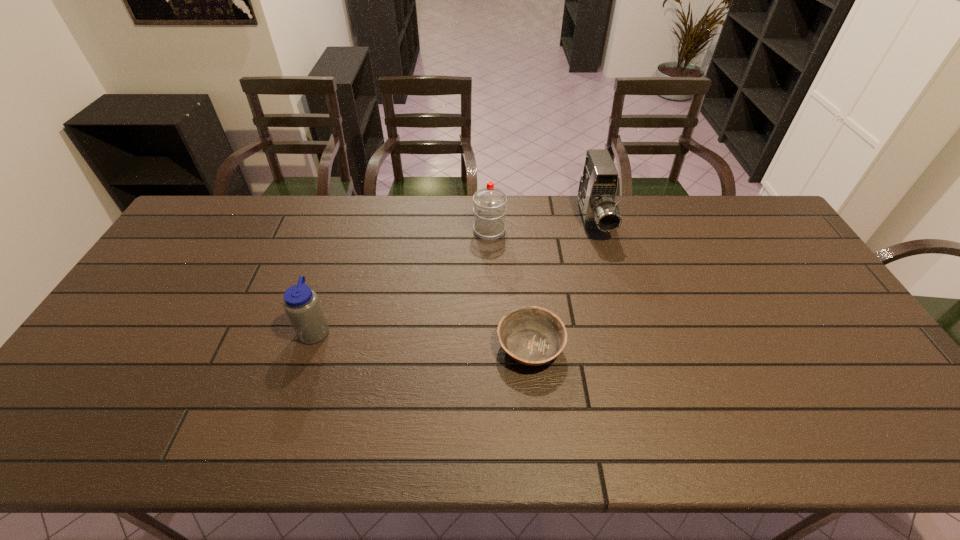
The image size is (960, 540). Identify the location of vacant space that is in between the rightmost object and the bowl. (562, 284).

Locate an element on the screen. The image size is (960, 540). free spot between the leftmost object and the bowl is located at coordinates (422, 339).

Locate an element on the screen. The image size is (960, 540). empty location between the second shortest object and the taller water bottle is located at coordinates (402, 280).

You are a GUI agent. You are given a task and a screenshot of the screen. Output one action in this format:
    pyautogui.click(x=<x>, y=<y>)
    Task: Click on the free space that is in between the right water bottle and the camcorder
    The height and width of the screenshot is (540, 960).
    Given the screenshot: What is the action you would take?
    pyautogui.click(x=541, y=225)

Where is `empty location between the bowl and the farther water bottle`? empty location between the bowl and the farther water bottle is located at coordinates (510, 289).

The image size is (960, 540). I want to click on free space between the taller water bottle and the nearer water bottle, so click(x=402, y=280).

Find the location of a particular element. The height and width of the screenshot is (540, 960). empty space between the farther water bottle and the leftmost object is located at coordinates (402, 280).

The height and width of the screenshot is (540, 960). Identify the location of empty space that is in between the farther water bottle and the bowl. (510, 289).

Locate which object ranks in proximity to the shortest object. Please provide its 2D coordinates. Your answer should be formatted as a tuple, i.e. [(x, y)], where the tuple contains the x and y coordinates of a point satisfying the conditions above.

[(489, 209)]

Locate an element on the screen. This screenshot has width=960, height=540. object identified as the closest to the leftmost object is located at coordinates (534, 336).